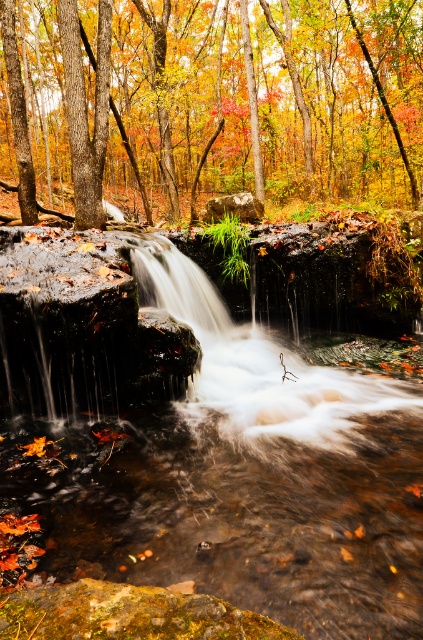
You are standing at the viewpoint where the image was taken. There are two points marked in the scene, point 1 at coordinates point (x=99, y=259) and point 2 at coordinates point (x=264, y=413). Which point is closer to you?

Point (x=264, y=413) is closer to you because point (x=99, y=259) is behind it.